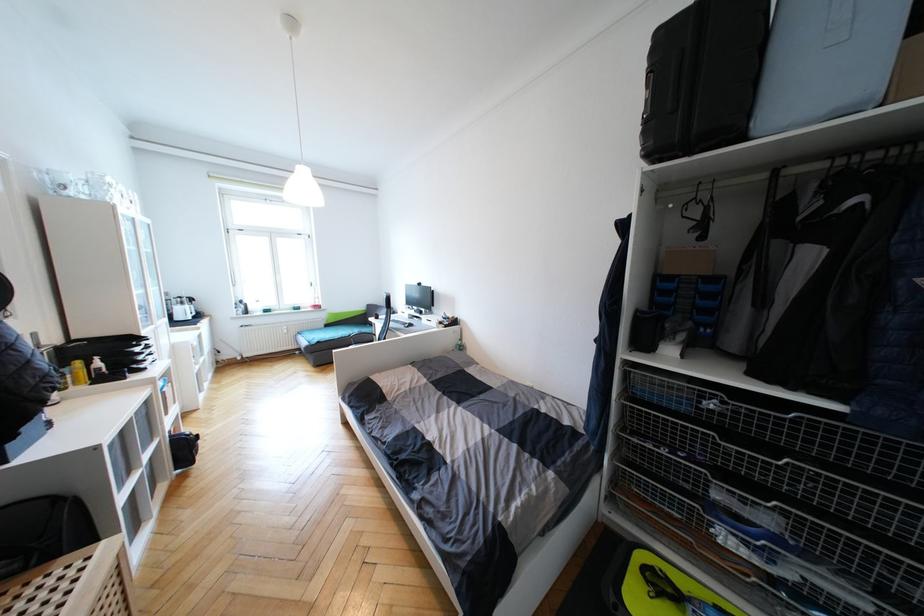
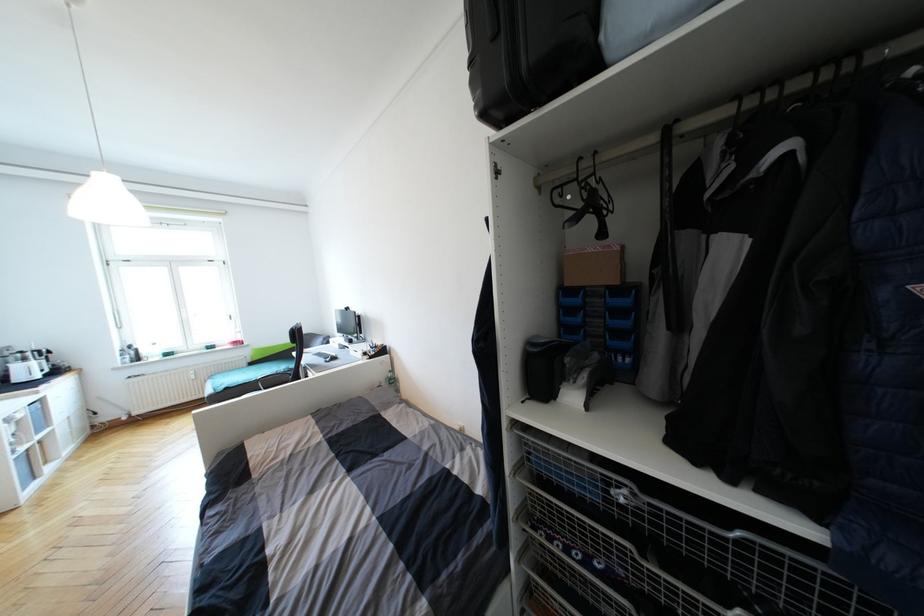
Which direction would the cameraman need to move to produce the second image?

The cameraman walked toward right, forward.